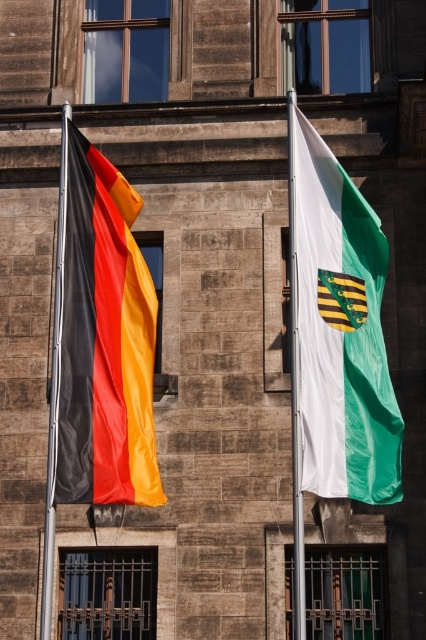
Which is in front, point (362, 426) or point (296, 556)?

Point (362, 426)

Is white/green fabric flag at right positioned at the back of white fabric flag at right?

That is True.

Describe the element at coordinates (339, 330) in the screenshot. The width and height of the screenshot is (426, 640). I see `white/green fabric flag at right` at that location.

Image resolution: width=426 pixels, height=640 pixels. Find the location of `white/green fabric flag at right`. white/green fabric flag at right is located at coordinates click(339, 330).

Between matte fabric flag at left and white fabric flag at right, which one is positioned lower?

matte fabric flag at left is below.

Can you confirm if matte fabric flag at left is shorter than white fabric flag at right?

Yes.

Describe the element at coordinates (103, 340) in the screenshot. I see `matte fabric flag at left` at that location.

This screenshot has height=640, width=426. I want to click on matte fabric flag at left, so click(x=103, y=340).

In the scene shown: Can you confirm if white/green fabric flag at right is smaller than black metal flag pole at left?

Correct, white/green fabric flag at right occupies less space than black metal flag pole at left.

Who is taller, white/green fabric flag at right or black metal flag pole at left?

black metal flag pole at left is taller.

Locate an element on the screen. white/green fabric flag at right is located at coordinates (339, 330).

This screenshot has width=426, height=640. What are the coordinates of `white/green fabric flag at right` in the screenshot? It's located at (339, 330).